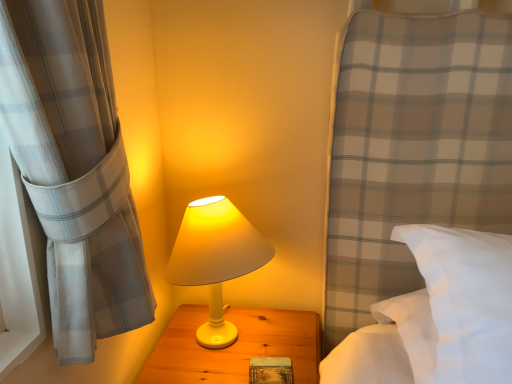
Question: Is white soft pillow at right smaller than white matte lamp at center?

Choices:
 (A) no
 (B) yes

Answer: (A)

Question: Considering the relative sizes of white soft pillow at right and white matte lamp at center in the image provided, is white soft pillow at right wider than white matte lamp at center?

Choices:
 (A) no
 (B) yes

Answer: (B)

Question: Does white soft pillow at right have a lesser height compared to white matte lamp at center?

Choices:
 (A) yes
 (B) no

Answer: (A)

Question: Does white soft pillow at right appear on the right side of white matte lamp at center?

Choices:
 (A) yes
 (B) no

Answer: (A)

Question: Does white soft pillow at right have a greater height compared to white matte lamp at center?

Choices:
 (A) no
 (B) yes

Answer: (A)

Question: From the image's perspective, is white matte lamp at center located above or below white soft pillow at right?

Choices:
 (A) below
 (B) above

Answer: (A)

Question: Is white matte lamp at center taller or shorter than white soft pillow at right?

Choices:
 (A) short
 (B) tall

Answer: (B)

Question: Looking at their shapes, would you say white matte lamp at center is wider or thinner than white soft pillow at right?

Choices:
 (A) thin
 (B) wide

Answer: (A)

Question: Visually, is white matte lamp at center positioned to the left or to the right of white soft pillow at right?

Choices:
 (A) right
 (B) left

Answer: (B)

Question: Is white matte lamp at center to the left or to the right of wooden textured book at center in the image?

Choices:
 (A) right
 (B) left

Answer: (B)

Question: Which is correct: white matte lamp at center is inside wooden textured book at center, or outside of it?

Choices:
 (A) inside
 (B) outside

Answer: (B)

Question: Is point (206, 337) positioned closer to the camera than point (275, 380)?

Choices:
 (A) farther
 (B) closer

Answer: (A)

Question: Is white matte lamp at center taller or shorter than wooden textured book at center?

Choices:
 (A) tall
 (B) short

Answer: (A)

Question: In terms of width, does white matte lamp at center look wider or thinner when compared to white matte wood nightstand at center?

Choices:
 (A) thin
 (B) wide

Answer: (A)

Question: From the image's perspective, relative to white matte wood nightstand at center, is white matte lamp at center above or below?

Choices:
 (A) above
 (B) below

Answer: (A)